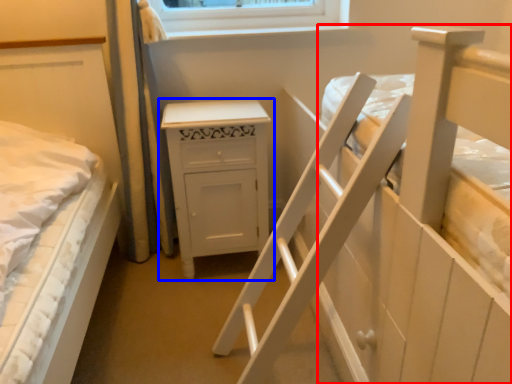
Question: Which of the following is the farthest to the observer, bed (highlighted by a red box) or chest of drawers (highlighted by a blue box)?

Choices:
 (A) bed
 (B) chest of drawers

Answer: (B)